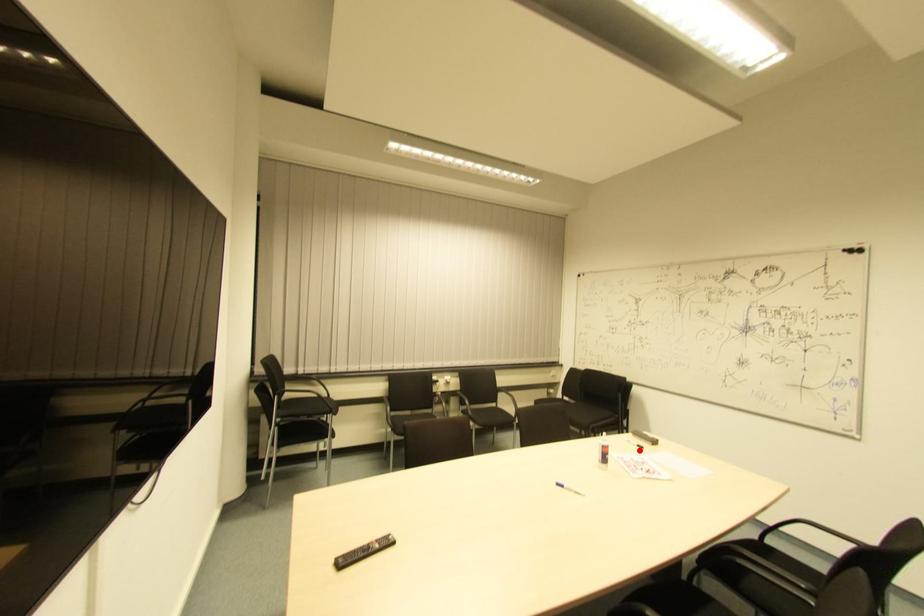
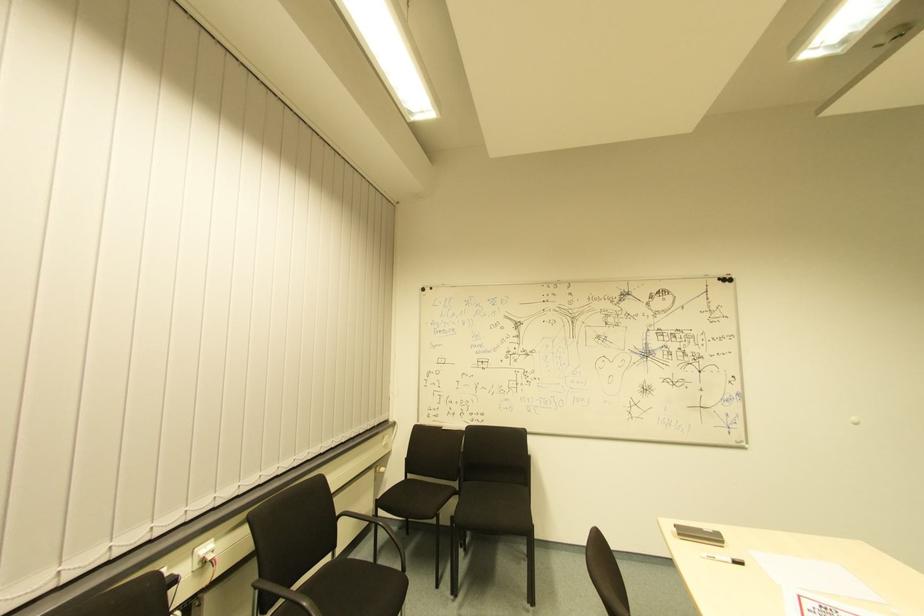
The point at the highlighted location is marked in the first image. Where is the corresponding point in the second image?

(737, 565)